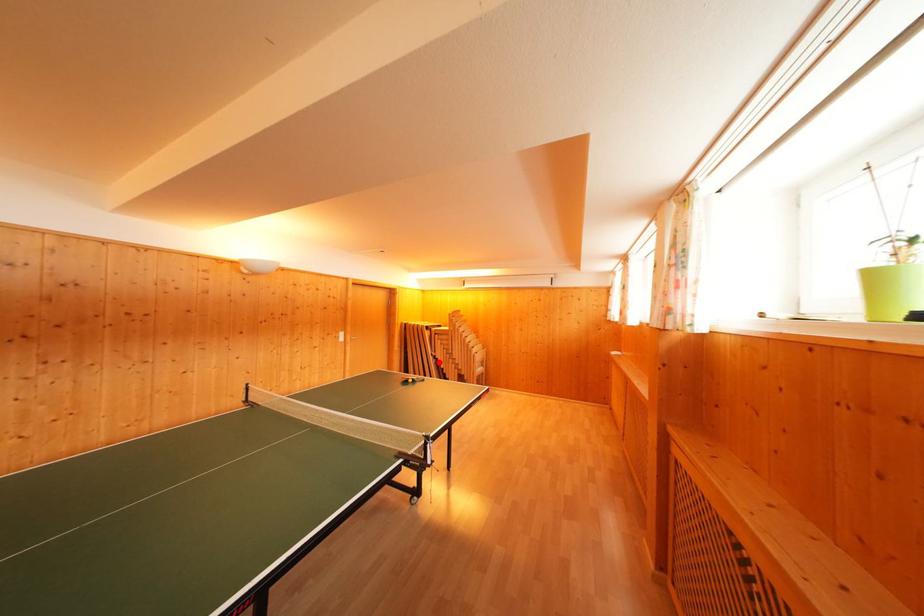
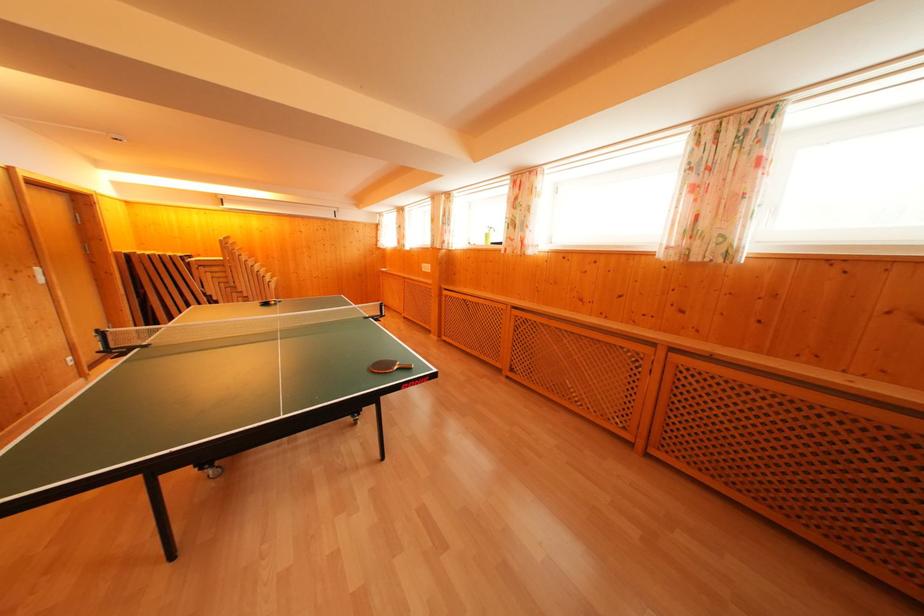
Locate, in the second image, the point that corresponds to the highlighted location in the first image.

(210, 300)